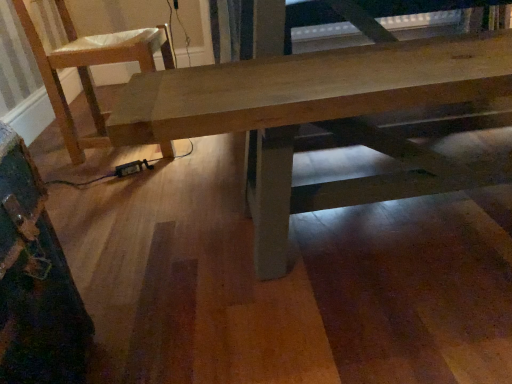
This screenshot has height=384, width=512. I want to click on free location in front of light brown wood chair at upper left, so click(x=121, y=189).